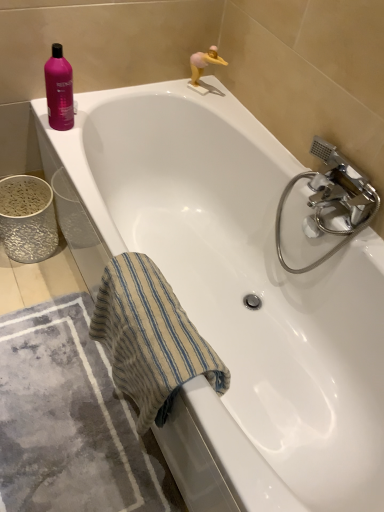
Identify the location of free space above gray textured bath mat at lower left (from a real-world perspective). The image size is (384, 512). (68, 413).